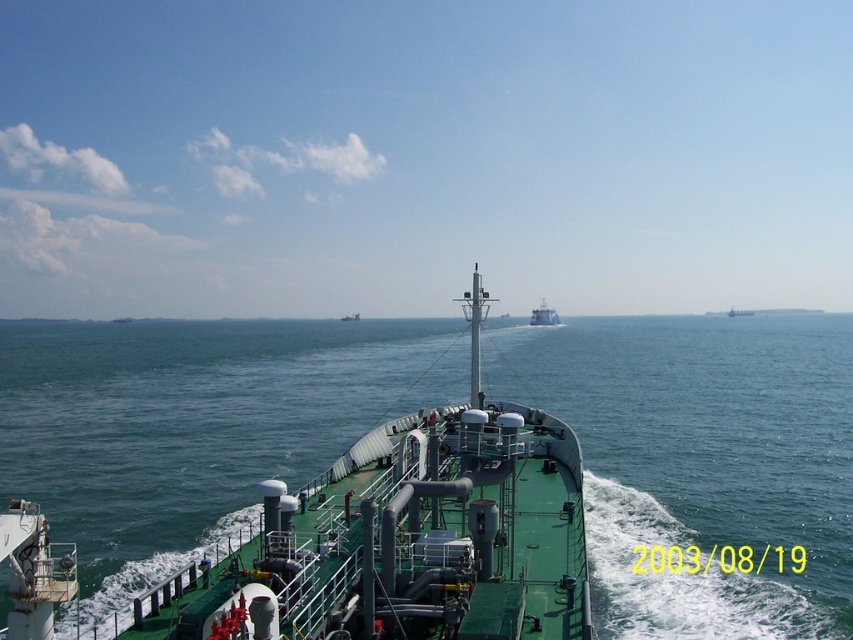
Where is `green water at center`? green water at center is located at coordinates (701, 461).

Between point (287, 364) and point (355, 314), which one is positioned in front?

Positioned in front is point (287, 364).

Locate an element on the screen. This screenshot has height=640, width=853. green water at center is located at coordinates (701, 461).

Is white glossy boat at center behind green matte ship at center?

No.

This screenshot has height=640, width=853. What do you see at coordinates (543, 316) in the screenshot? I see `white glossy boat at center` at bounding box center [543, 316].

The height and width of the screenshot is (640, 853). I want to click on white glossy boat at center, so click(543, 316).

Can you confirm if green water at center is taller than white glossy boat at center?

Incorrect, green water at center's height is not larger of white glossy boat at center's.

Between green water at center and white glossy boat at center, which one has more height?

Standing taller between the two is white glossy boat at center.

You are a GUI agent. You are given a task and a screenshot of the screen. Output one action in this format:
    pyautogui.click(x=<x>, y=<y>)
    Task: Click on the green water at center
    The width and height of the screenshot is (853, 640).
    Given the screenshot: What is the action you would take?
    click(x=701, y=461)

Identify the location of green water at center. (701, 461).